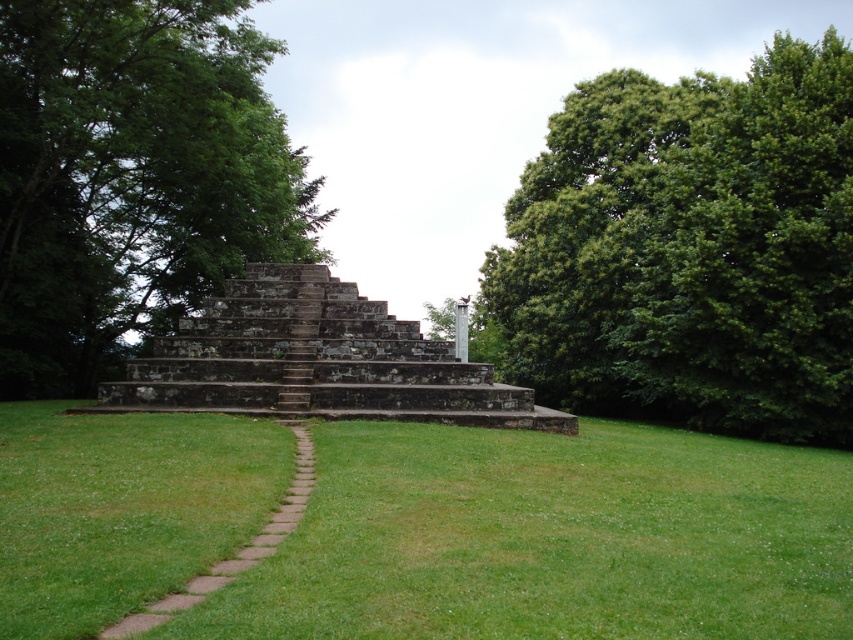
You are a GUI agent. You are given a task and a screenshot of the screen. Output one action in this format:
    pyautogui.click(x=<x>, y=<y>)
    Task: Click on the green leafy tree at center
    
    Given the screenshot: What is the action you would take?
    pyautogui.click(x=132, y=179)

Can you confirm if green leafy tree at center is taller than brown stone path at center?

Correct, green leafy tree at center is much taller as brown stone path at center.

The width and height of the screenshot is (853, 640). What are the coordinates of `green leafy tree at center` in the screenshot? It's located at (132, 179).

At what (x,y) coordinates should I click in order to perform the action: click on green leafy tree at center. Please return your answer as a coordinate pair (x, y). Looking at the image, I should click on (132, 179).

Locate an element on the screen. rusty stone stairs at center is located at coordinates (315, 362).

Does point (283, 337) lie in front of point (264, 556)?

No.

Who is more forward, (318, 400) or (306, 481)?

Point (306, 481) is more forward.

I want to click on rusty stone stairs at center, so click(x=315, y=362).

Is green grass at center thinner than green leafy tree at upper right?

Yes.

Can you confirm if green grass at center is shorter than green leafy tree at upper right?

Indeed, green grass at center has a lesser height compared to green leafy tree at upper right.

Identify the location of green grass at center. The image size is (853, 640). (550, 538).